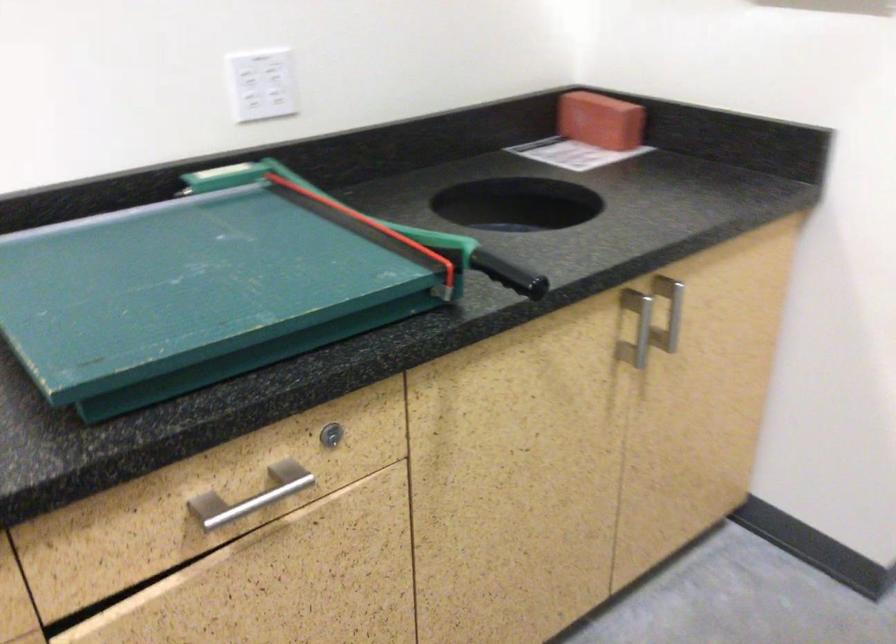
The image size is (896, 644). Describe the element at coordinates (510, 274) in the screenshot. I see `the paper cutter handle` at that location.